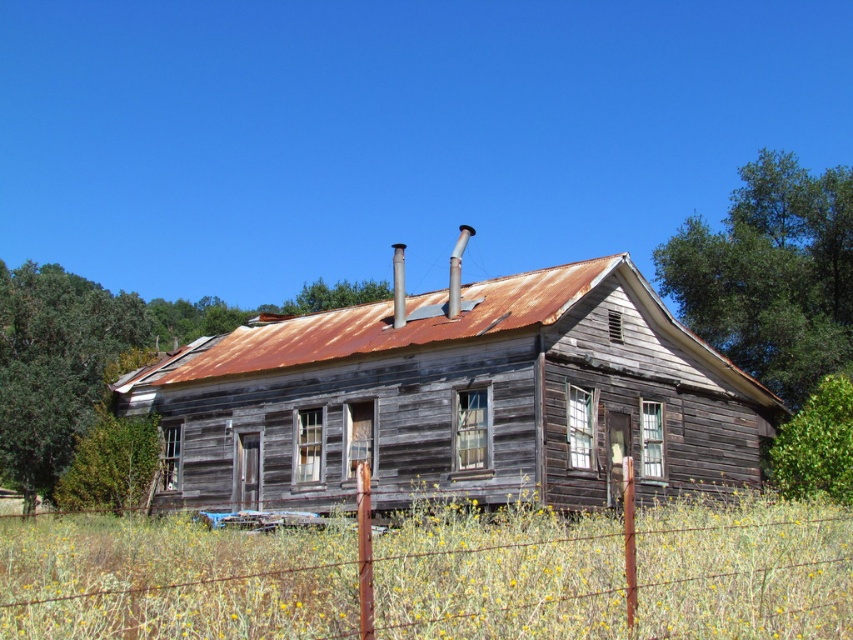
Question: Is green leafy tree at upper right in front of green leafy tree at upper center?

Choices:
 (A) no
 (B) yes

Answer: (B)

Question: Can you confirm if weathered wood tree at center is wider than green leafy tree at upper center?

Choices:
 (A) yes
 (B) no

Answer: (A)

Question: Does weathered wood tree at center have a smaller size compared to green leafy tree at upper center?

Choices:
 (A) yes
 (B) no

Answer: (B)

Question: Estimate the real-world distances between objects in this image. Which object is farther from the weathered wood tree at center?

Choices:
 (A) green leafy tree at left
 (B) green leafy tree at upper right
 (C) green leafy tree at upper center

Answer: (B)

Question: Estimate the real-world distances between objects in this image. Which object is closer to the green leafy tree at upper center?

Choices:
 (A) green leafy tree at left
 (B) green leafy tree at upper right
 (C) weathered wood tree at center

Answer: (C)

Question: Which object is closer to the camera taking this photo?

Choices:
 (A) green leafy tree at upper center
 (B) green leafy tree at left
 (C) green leafy tree at upper right
 (D) weathered wood tree at center

Answer: (D)